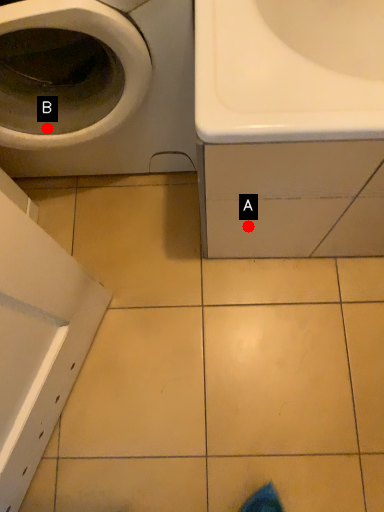
Question: Two points are circled on the image, labeled by A and B beside each circle. Which point is closer to the camera?

Choices:
 (A) A is closer
 (B) B is closer

Answer: (B)